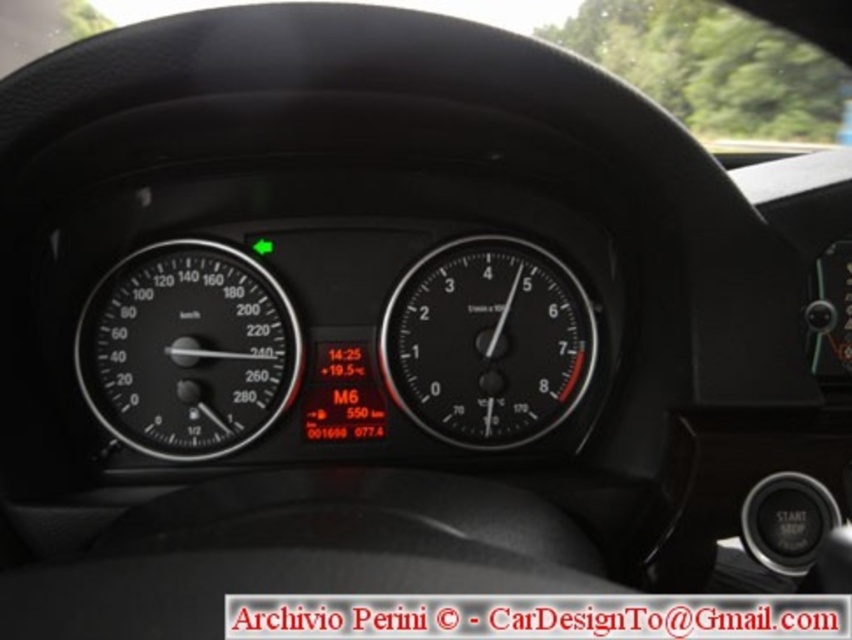
Question: Which point is farther to the camera?

Choices:
 (A) black matte speedometer at center
 (B) black matte speedometer at left
 (C) transparent glass windshield at upper center

Answer: (C)

Question: Which of the following is the closest to the observer?

Choices:
 (A) transparent glass windshield at upper center
 (B) black matte speedometer at left
 (C) black matte speedometer at center

Answer: (B)

Question: Which point appears closest to the camera in this image?

Choices:
 (A) tap(193, 305)
 (B) tap(13, 19)
 (C) tap(494, 236)

Answer: (A)

Question: Can you confirm if black matte speedometer at center is positioned to the left of transparent glass windshield at upper center?

Choices:
 (A) no
 (B) yes

Answer: (B)

Question: Does black matte speedometer at left appear under transparent glass windshield at upper center?

Choices:
 (A) no
 (B) yes

Answer: (B)

Question: In this image, where is black matte speedometer at left located relative to black matte speedometer at center?

Choices:
 (A) right
 (B) left

Answer: (B)